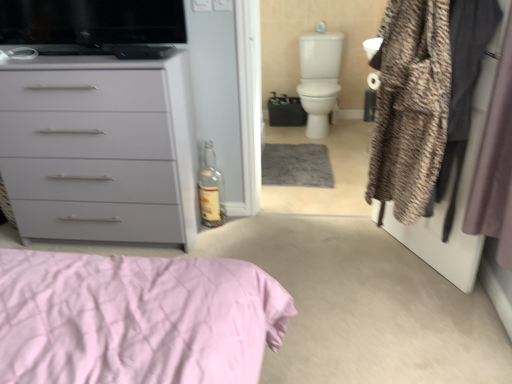
Where is `empty space that is in between fuzzy fabric coat at right and matte gray chest of drawers at left`? Image resolution: width=512 pixels, height=384 pixels. empty space that is in between fuzzy fabric coat at right and matte gray chest of drawers at left is located at coordinates (307, 248).